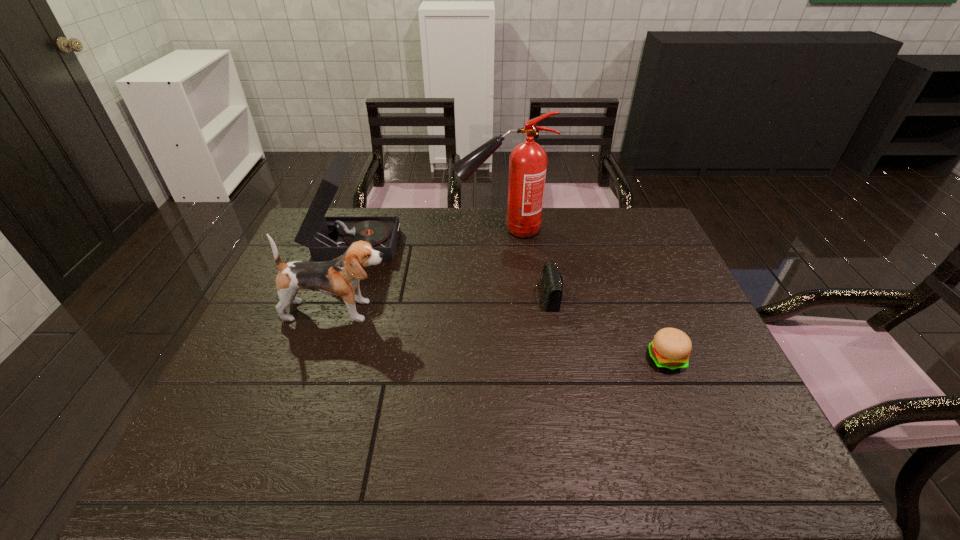
Where is `free location located 0.170m at the face of the puppy`? Image resolution: width=960 pixels, height=540 pixels. free location located 0.170m at the face of the puppy is located at coordinates click(x=455, y=311).

You are a GUI agent. You are given a task and a screenshot of the screen. Output one action in this format:
    pyautogui.click(x=<x>, y=<y>)
    Task: Click on the vacant region located on the front flap of the clutch bag
    This screenshot has height=540, width=960.
    Given the screenshot: What is the action you would take?
    pyautogui.click(x=429, y=296)

I want to click on free space located on the front flap of the clutch bag, so click(x=397, y=296).

In order to click on vacant space located 0.170m on the front flap of the clutch bag in this screenshot , I will do `click(474, 296)`.

Locate an element on the screen. free location located on the front of the rightmost object is located at coordinates (693, 427).

Locate an element on the screen. Image resolution: width=960 pixels, height=540 pixels. fire extinguisher that is at the far edge is located at coordinates (528, 161).

This screenshot has width=960, height=540. I want to click on phonograph_record that is at the far edge, so click(x=327, y=238).

Find the location of a particular element. phonograph_record that is at the left edge is located at coordinates (327, 238).

Identify the location of puppy present at the left edge. Image resolution: width=960 pixels, height=540 pixels. (341, 276).

This screenshot has height=540, width=960. In order to click on object located in the right edge section of the desktop in this screenshot , I will do click(670, 349).